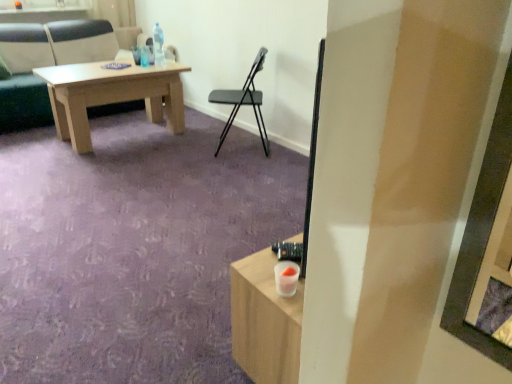
Question: Is black plastic chair at center, placed as the 2th chair when sorted from left to right, oriented towards light brown wooden table at upper left, which is counted as the first chair, starting from the back?

Choices:
 (A) yes
 (B) no

Answer: (B)

Question: Is black plastic chair at center, which ranks as the first chair in front-to-back order, completely or partially outside of light brown wooden table at upper left, which is counted as the first chair, starting from the back?

Choices:
 (A) yes
 (B) no

Answer: (A)

Question: Is black plastic chair at center, the second chair in the back-to-front sequence, wider than light brown wooden table at upper left, which is the 2th chair from right to left?

Choices:
 (A) yes
 (B) no

Answer: (B)

Question: Does black plastic chair at center, acting as the 1th chair starting from the right, have a lesser height compared to light brown wooden table at upper left, which is counted as the first chair, starting from the back?

Choices:
 (A) yes
 (B) no

Answer: (A)

Question: Considering the relative sizes of black plastic chair at center, acting as the 1th chair starting from the right, and light brown wooden table at upper left, the 1th chair in the left-to-right sequence, in the image provided, is black plastic chair at center, acting as the 1th chair starting from the right, bigger than light brown wooden table at upper left, the 1th chair in the left-to-right sequence,?

Choices:
 (A) yes
 (B) no

Answer: (B)

Question: Which is correct: black plastic chair at center, the second chair in the back-to-front sequence, is inside light brown wooden table at upper left, the 1th chair in the left-to-right sequence, or outside of it?

Choices:
 (A) outside
 (B) inside

Answer: (A)

Question: Considering the positions of black plastic chair at center, acting as the 1th chair starting from the right, and light brown wooden table at upper left, which is counted as the first chair, starting from the back, in the image, is black plastic chair at center, acting as the 1th chair starting from the right, wider or thinner than light brown wooden table at upper left, which is counted as the first chair, starting from the back,?

Choices:
 (A) thin
 (B) wide

Answer: (A)

Question: In the image, is black plastic chair at center, acting as the 1th chair starting from the right, positioned in front of or behind light brown wooden table at upper left, marked as the 2th chair in a front-to-back arrangement?

Choices:
 (A) behind
 (B) front

Answer: (B)

Question: Considering the positions of black plastic chair at center, the second chair in the back-to-front sequence, and light brown wooden table at upper left, the 1th chair in the left-to-right sequence, in the image, is black plastic chair at center, the second chair in the back-to-front sequence, bigger or smaller than light brown wooden table at upper left, the 1th chair in the left-to-right sequence,?

Choices:
 (A) big
 (B) small

Answer: (B)

Question: In the image, is clear plastic bottle at upper center positioned in front of or behind light brown wooden table at upper left, which is the 2th chair from right to left?

Choices:
 (A) front
 (B) behind

Answer: (B)

Question: In the image, is clear plastic bottle at upper center on the left side or the right side of light brown wooden table at upper left, the 1th chair in the left-to-right sequence?

Choices:
 (A) right
 (B) left

Answer: (A)

Question: Is point pos(162,39) closer or farther from the camera than point pos(33,97)?

Choices:
 (A) farther
 (B) closer

Answer: (A)

Question: Is clear plastic bottle at upper center wider or thinner than light brown wooden table at upper left, which is the 2th chair from right to left?

Choices:
 (A) wide
 (B) thin

Answer: (B)

Question: From a real-world perspective, is black plastic chair at center, placed as the 2th chair when sorted from left to right, physically located above or below clear plastic bottle at upper center?

Choices:
 (A) below
 (B) above

Answer: (A)

Question: From the image's perspective, is black plastic chair at center, acting as the 1th chair starting from the right, located above or below clear plastic bottle at upper center?

Choices:
 (A) above
 (B) below

Answer: (B)